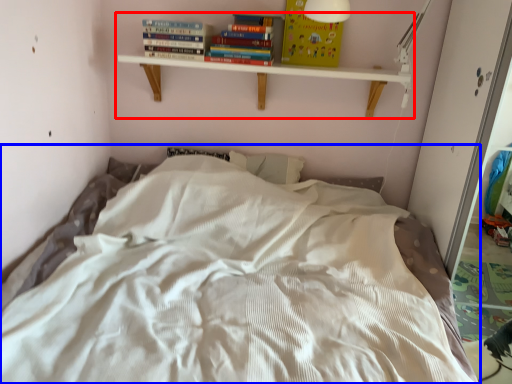
Question: Which object is further to the camera taking this photo, shelf (highlighted by a red box) or bed (highlighted by a blue box)?

Choices:
 (A) shelf
 (B) bed

Answer: (A)